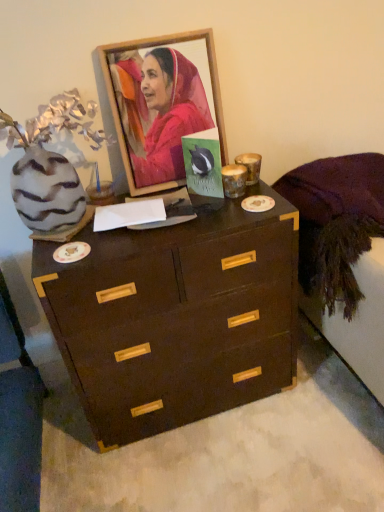
Find the location of a particular element. This screenshot has height=512, width=384. unoccupied area in front of green matte postcard at center is located at coordinates (223, 215).